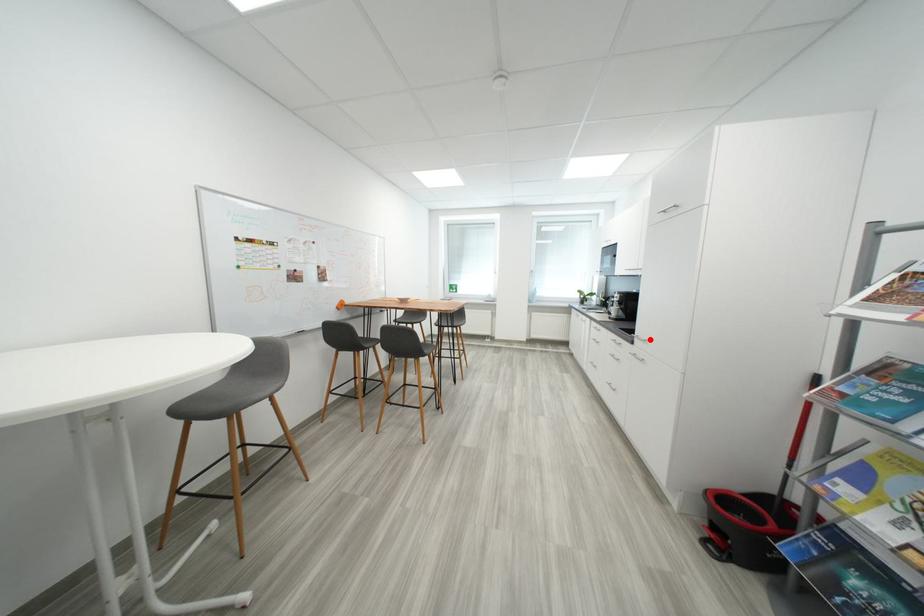
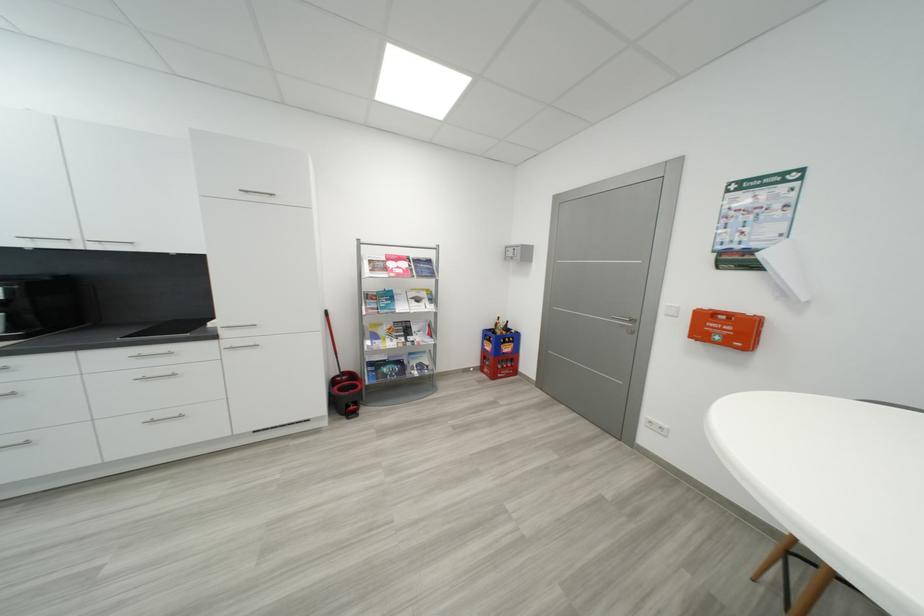
Question: I am providing you with two images of the same scene from different viewpoints. A red point is shown in image1. For the corresponding object point in image2, is it positioned nearer or farther from the camera?

Choices:
 (A) Nearer
 (B) Farther

Answer: (B)